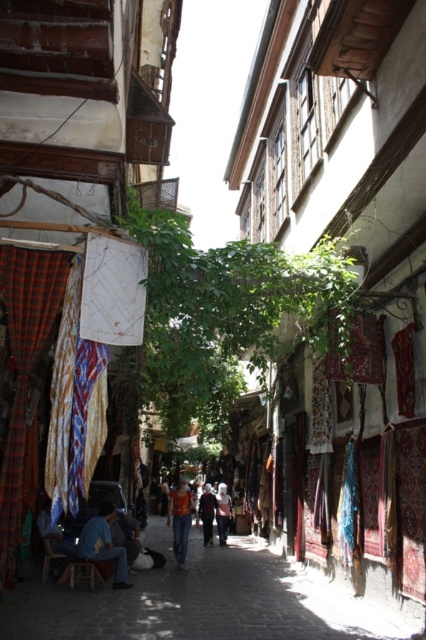
You are standing in the middle of the street looking at two points in the scene. The first point is at coordinates point (161,620) and the second is at point (58,544). Which point is closer to you?

Point (161,620) is closer to the camera than point (58,544), so the first point is closer to you.